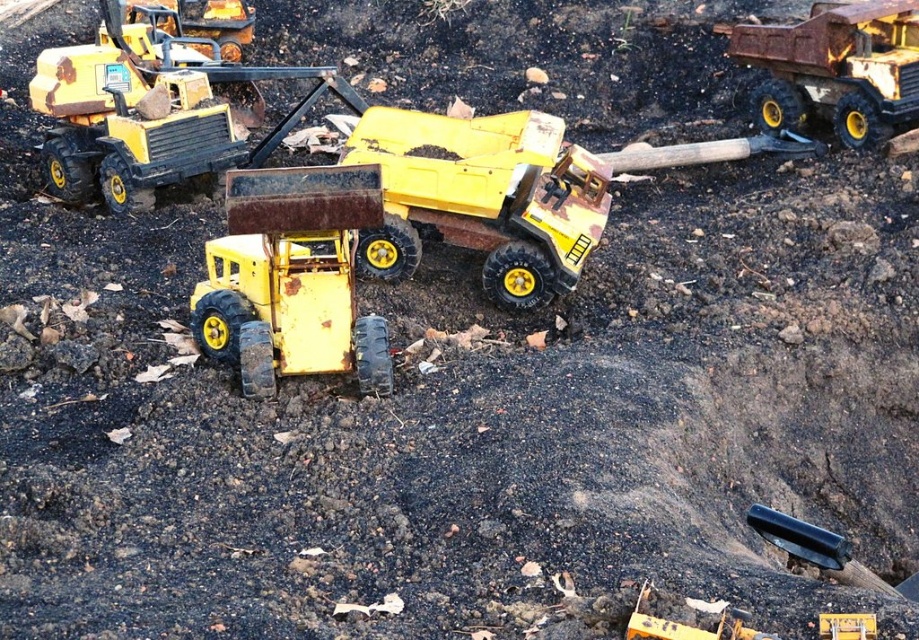
Who is lower down, rusty yellow bulldozer at center or matte yellow toy truck at upper left?

rusty yellow bulldozer at center is lower down.

I want to click on rusty yellow bulldozer at center, so click(x=291, y=280).

The width and height of the screenshot is (919, 640). I want to click on rusty yellow bulldozer at center, so click(291, 280).

Which is below, matte yellow dump truck at center or matte yellow toy truck at upper left?

matte yellow dump truck at center is lower down.

Is matte yellow dump truck at center positioned at the back of matte yellow toy truck at upper left?

No, it is in front of matte yellow toy truck at upper left.

Where is `matte yellow dump truck at center`? The image size is (919, 640). matte yellow dump truck at center is located at coordinates (482, 196).

I want to click on matte yellow dump truck at center, so click(482, 196).

Who is lower down, matte yellow toy truck at upper left or rusty metal dump truck at upper right?

Positioned lower is matte yellow toy truck at upper left.

Does matte yellow toy truck at upper left appear under rusty metal dump truck at upper right?

Yes, matte yellow toy truck at upper left is below rusty metal dump truck at upper right.

The image size is (919, 640). In order to click on matte yellow toy truck at upper left in this screenshot , I will do `click(148, 113)`.